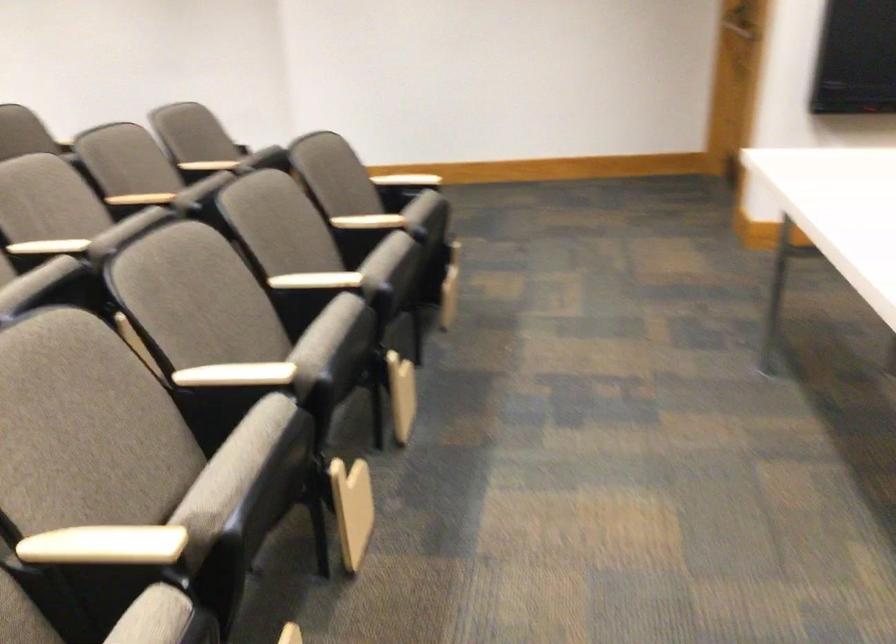
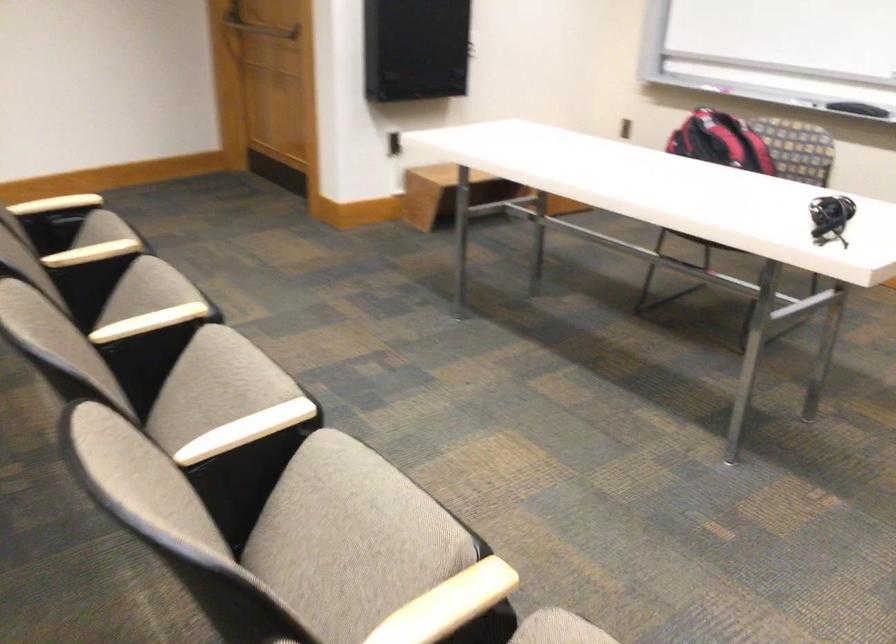
The point at (305, 339) is marked in the first image. Where is the corresponding point in the second image?

(214, 386)